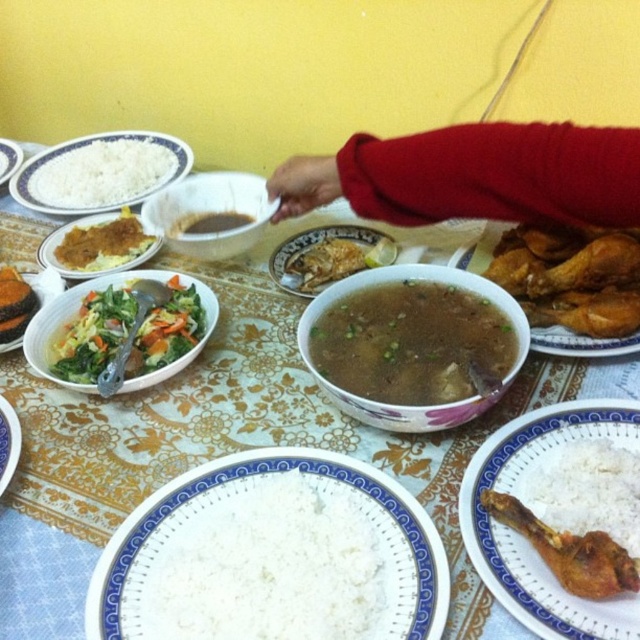
Question: Based on their relative distances, which object is farther from the brown glossy fish at center?

Choices:
 (A) brown liquid soup at center
 (B) white glossy bowl at center
 (C) translucent glass bowl at center

Answer: (B)

Question: Which of the following is the closest to the observer?

Choices:
 (A) (1, 164)
 (B) (620, 257)

Answer: (B)

Question: Is green leafy vegetables at center to the right of brown crumbly rice at center-left from the viewer's perspective?

Choices:
 (A) yes
 (B) no

Answer: (A)

Question: Does green leafy vegetables at center have a greater width compared to green leafy salad at left?

Choices:
 (A) no
 (B) yes

Answer: (B)

Question: Based on their relative distances, which object is farther from the white ceramic plate at upper left?

Choices:
 (A) golden crispy fried chicken at right
 (B) green leafy salad at left

Answer: (A)

Question: Is white matte rice at lower right further to camera compared to white glossy bowl at center?

Choices:
 (A) no
 (B) yes

Answer: (A)